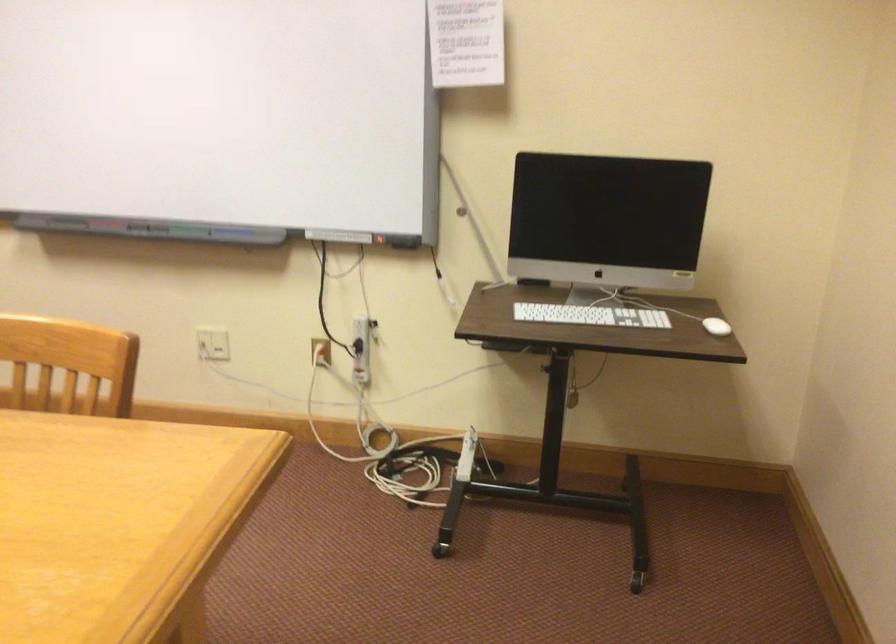
In order to click on whiteboard keyboard in this screenshot , I will do `click(590, 315)`.